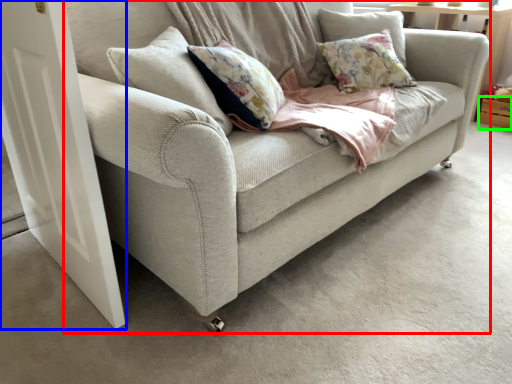
Question: Estimate the real-world distances between objects in this image. Which object is farther from studio couch (highlighted by a red box), screen door (highlighted by a blue box) or drawer (highlighted by a green box)?

Choices:
 (A) screen door
 (B) drawer

Answer: (B)